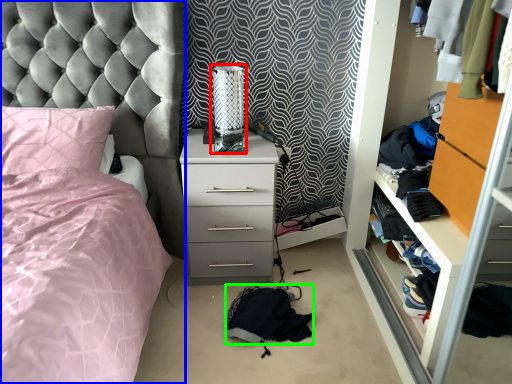
Question: Based on their relative distances, which object is nearer to table lamp (highlighted by a red box)? Choose from bed (highlighted by a blue box) and clothing (highlighted by a green box).

Choices:
 (A) bed
 (B) clothing

Answer: (A)